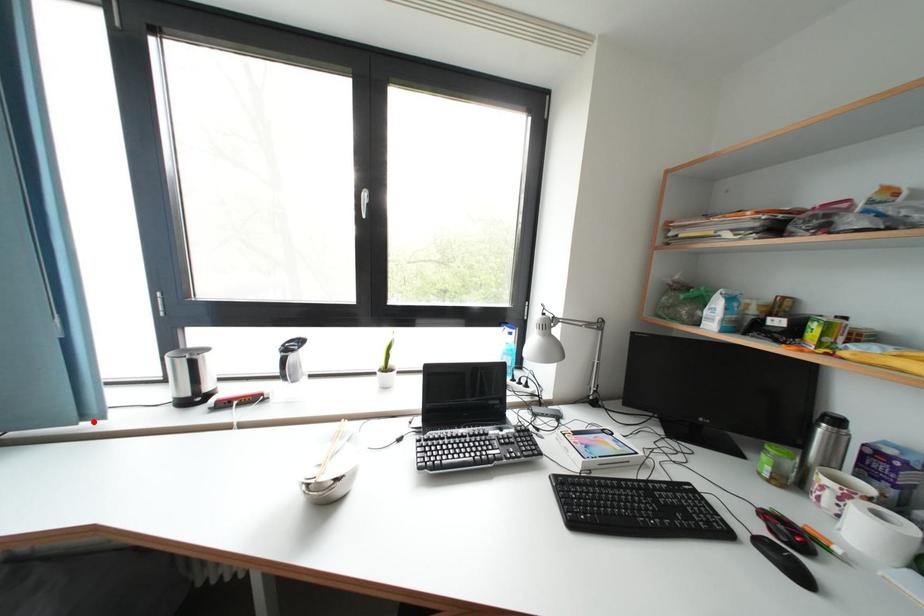
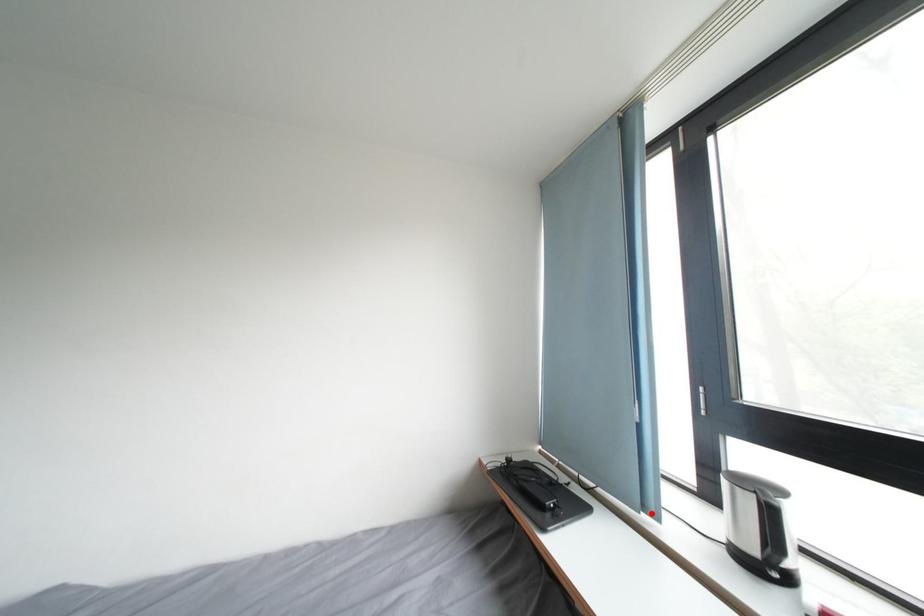
I am providing you with two images of the same scene from different viewpoints. A red point is marked on the first image and another point is marked on the second image. Is the marked point in image1 the same physical position as the marked point in image2?

Yes